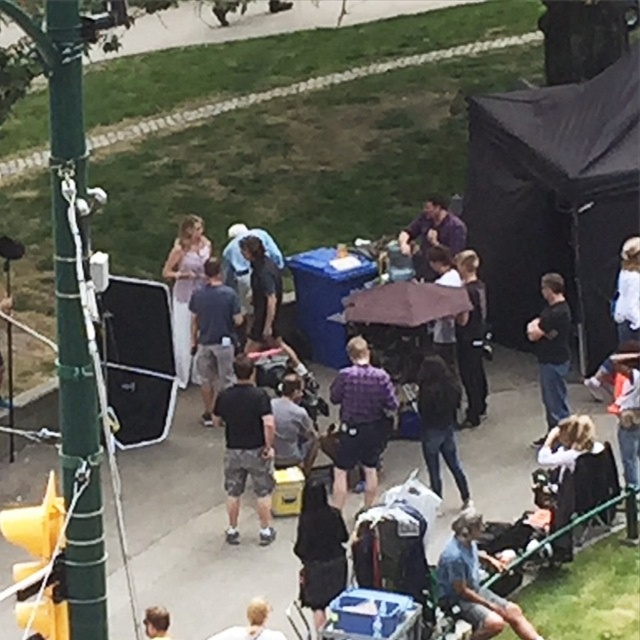
Question: Is black matte shirt at center positioned behind light brown hair at lower left?

Choices:
 (A) no
 (B) yes

Answer: (B)

Question: Does black matte jacket at center appear on the right side of light gray shirt at center?

Choices:
 (A) yes
 (B) no

Answer: (A)

Question: Which object appears closest to the camera in this image?

Choices:
 (A) denim shorts at lower right
 (B) dark gray shorts at center
 (C) dark brown leather jacket at center
 (D) black matte jacket at center

Answer: (A)

Question: Is black matte jacket at center smaller than light brown hair at lower left?

Choices:
 (A) yes
 (B) no

Answer: (B)

Question: Among these points, which one is farthest from the camera?

Choices:
 (A) (161, 616)
 (B) (369, 506)
 (C) (192, 340)

Answer: (C)

Question: Which point appears farthest from the camera in this image?

Choices:
 (A) (273, 339)
 (B) (157, 620)
 (C) (461, 385)

Answer: (A)